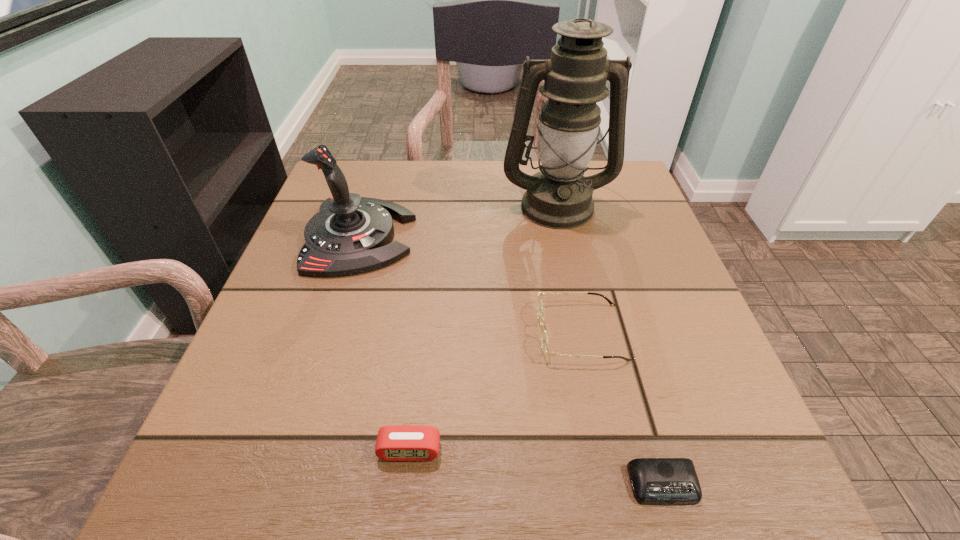
What are the coordinates of `blank area located 0.230m on the lenses of the spectacles` in the screenshot? It's located at (403, 332).

This screenshot has width=960, height=540. Identify the location of vacant region located on the lenses of the spectacles. (456, 332).

The image size is (960, 540). In order to click on free spot located on the lenses of the spectacles in this screenshot , I will do `click(479, 332)`.

Identify the location of oil lamp situated at the far edge. The height and width of the screenshot is (540, 960). (559, 196).

Find the location of a particular element. The height and width of the screenshot is (540, 960). joystick that is at the far edge is located at coordinates (350, 234).

Image resolution: width=960 pixels, height=540 pixels. In order to click on object located in the left edge section of the desktop in this screenshot , I will do `click(350, 234)`.

This screenshot has height=540, width=960. What are the coordinates of `oil lamp that is at the right edge` in the screenshot? It's located at (559, 196).

Identify the location of spectacles that is at the right edge. (544, 340).

Find the location of `alarm clock that is at the right edge`. alarm clock that is at the right edge is located at coordinates (657, 481).

The height and width of the screenshot is (540, 960). Identify the location of object located at the far left corner. (350, 234).